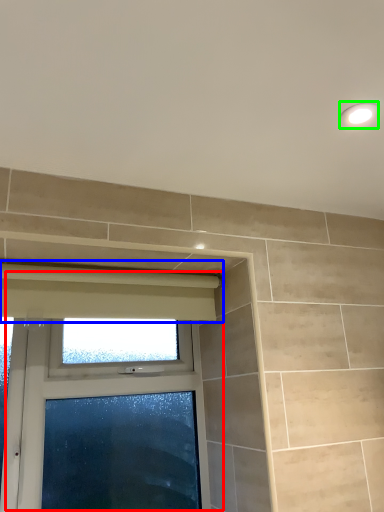
Question: Based on their relative distances, which object is farther from window (highlighted by a red box)? Choose from curtain (highlighted by a blue box) and light fixture (highlighted by a green box).

Choices:
 (A) curtain
 (B) light fixture

Answer: (B)